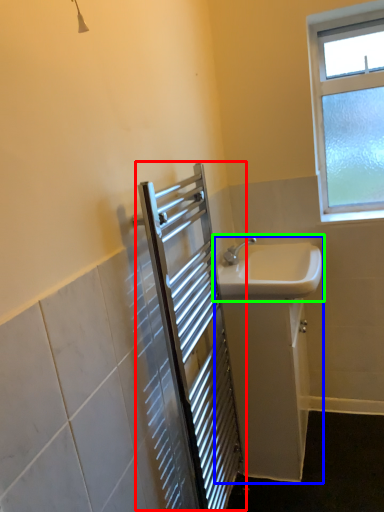
Question: Estimate the real-world distances between objects in this image. Which object is closer to screen door (highlighted by a red box), sink (highlighted by a blue box) or sink (highlighted by a green box)?

Choices:
 (A) sink
 (B) sink

Answer: (A)